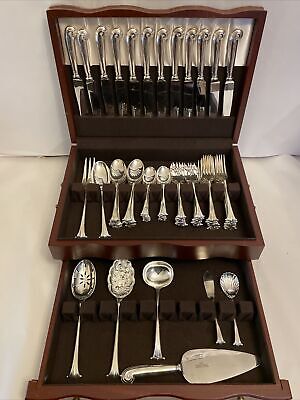
At what (x,y) coordinates should I click in order to perform the action: click on forks. Please return your answer as a coordinate pair (x, y). This screenshot has width=300, height=400. Looking at the image, I should click on (86, 180), (177, 175), (192, 176), (209, 172), (220, 173).